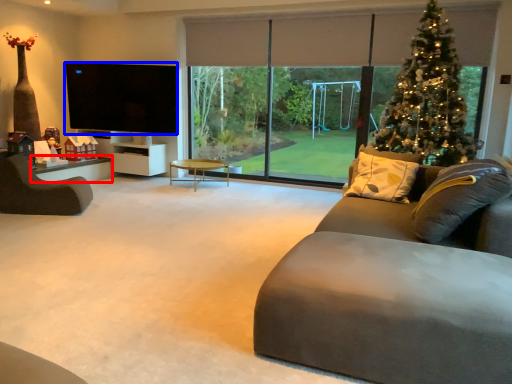
Question: Which point is further to the camera, table (highlighted by a red box) or television (highlighted by a blue box)?

Choices:
 (A) table
 (B) television

Answer: (B)